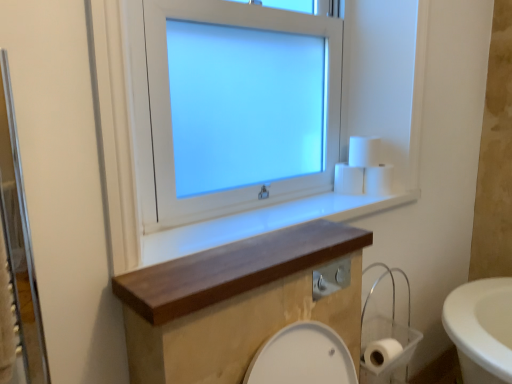
Question: Based on their positions, is wooden shelf at center located to the left or right of white glossy window at upper center?

Choices:
 (A) left
 (B) right

Answer: (B)

Question: Is point (222, 264) positioned closer to the camera than point (237, 188)?

Choices:
 (A) closer
 (B) farther

Answer: (A)

Question: Estimate the real-world distances between objects in this image. Which object is farther from the white matte toilet paper at upper right, positioned as the third toilet paper in top-to-bottom order?

Choices:
 (A) white glossy window at upper center
 (B) wooden shelf at center
 (C) wooden at upper center
 (D) white matte toilet paper at lower right, acting as the 4th toilet paper starting from the top
 (E) white matte toilet paper at upper right, the 1th toilet paper viewed from the top

Answer: (B)

Question: Considering the real-world distances, which object is closest to the white matte toilet paper at upper right, positioned as the 4th toilet paper in bottom-to-top order?

Choices:
 (A) white glossy window at upper center
 (B) white matte toilet paper at center, acting as the 2th toilet paper starting from the top
 (C) wooden at upper center
 (D) wooden shelf at center
 (E) white matte toilet paper at upper right, positioned as the third toilet paper in top-to-bottom order

Answer: (E)